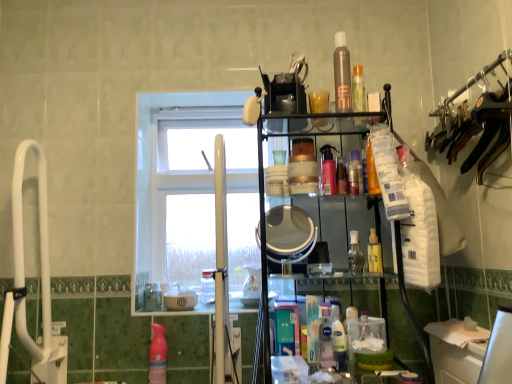
Question: Would you consider matte silver mirror at center to be distant from yellow matte spray bottle at center-right, marked as the 6th toiletry in a top-to-bottom arrangement?

Choices:
 (A) no
 (B) yes

Answer: (A)

Question: From a real-world perspective, is matte silver mirror at center below yellow matte spray bottle at center-right, marked as the 6th toiletry in a top-to-bottom arrangement?

Choices:
 (A) yes
 (B) no

Answer: (B)

Question: Considering the relative sizes of matte silver mirror at center and yellow matte spray bottle at center-right, marked as the 6th toiletry in a top-to-bottom arrangement, in the image provided, is matte silver mirror at center smaller than yellow matte spray bottle at center-right, marked as the 6th toiletry in a top-to-bottom arrangement,?

Choices:
 (A) yes
 (B) no

Answer: (B)

Question: From a real-world perspective, is matte silver mirror at center located higher than yellow matte spray bottle at center-right, the first toiletry ordered from the bottom?

Choices:
 (A) yes
 (B) no

Answer: (A)

Question: Does matte silver mirror at center have a greater height compared to yellow matte spray bottle at center-right, marked as the 6th toiletry in a top-to-bottom arrangement?

Choices:
 (A) yes
 (B) no

Answer: (A)

Question: From the image's perspective, is matte silver mirror at center located beneath yellow matte spray bottle at center-right, marked as the 6th toiletry in a top-to-bottom arrangement?

Choices:
 (A) no
 (B) yes

Answer: (A)

Question: From the image's perspective, is clear plastic bottle at center located beneath white glass window at center?

Choices:
 (A) no
 (B) yes

Answer: (B)

Question: Is clear plastic bottle at center taller than white glass window at center?

Choices:
 (A) yes
 (B) no

Answer: (B)

Question: Does clear plastic bottle at center have a greater width compared to white glass window at center?

Choices:
 (A) yes
 (B) no

Answer: (B)

Question: Is white glass window at center completely or partially inside clear plastic bottle at center?

Choices:
 (A) yes
 (B) no

Answer: (B)

Question: Is clear plastic bottle at center facing towards white glass window at center?

Choices:
 (A) no
 (B) yes

Answer: (A)

Question: Is clear plastic bottle at center far from white glass window at center?

Choices:
 (A) yes
 (B) no

Answer: (B)

Question: From a real-world perspective, does translucent plastic spray bottle at center, acting as the 3th toiletry starting from the bottom, stand above satin brown spray can at upper center, positioned as the 6th toiletry in bottom-to-top order?

Choices:
 (A) yes
 (B) no

Answer: (B)